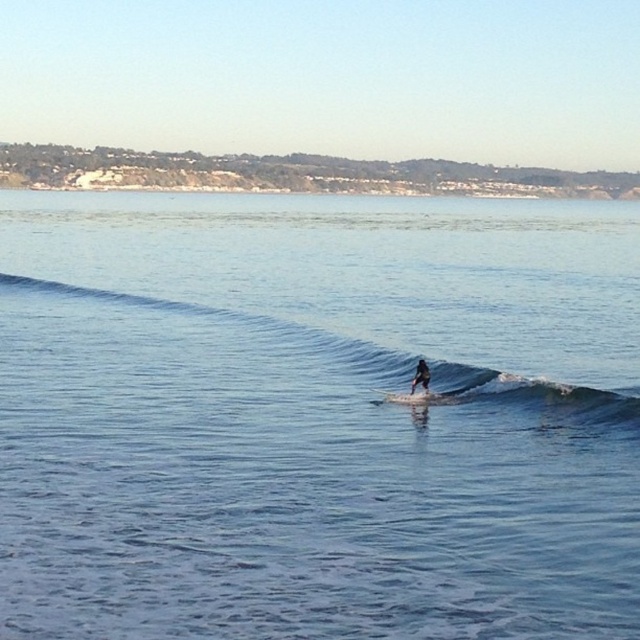
Question: Is blue water at center positioned at the back of dark blue wetsuit at center?

Choices:
 (A) no
 (B) yes

Answer: (A)

Question: Is blue water at center above black matte surfboard at center?

Choices:
 (A) yes
 (B) no

Answer: (A)

Question: Among these points, which one is farthest from the camera?

Choices:
 (A) (412, 404)
 (B) (413, 387)
 (C) (497, 637)
 (D) (518, 381)

Answer: (B)

Question: Among these objects, which one is farthest from the camera?

Choices:
 (A) black matte surfboard at center
 (B) blue smooth wave at center

Answer: (A)

Question: Which point appears farthest from the camera in this image?

Choices:
 (A) (404, 497)
 (B) (385, 401)

Answer: (B)

Question: Does blue water at center have a larger size compared to blue smooth wave at center?

Choices:
 (A) no
 (B) yes

Answer: (B)